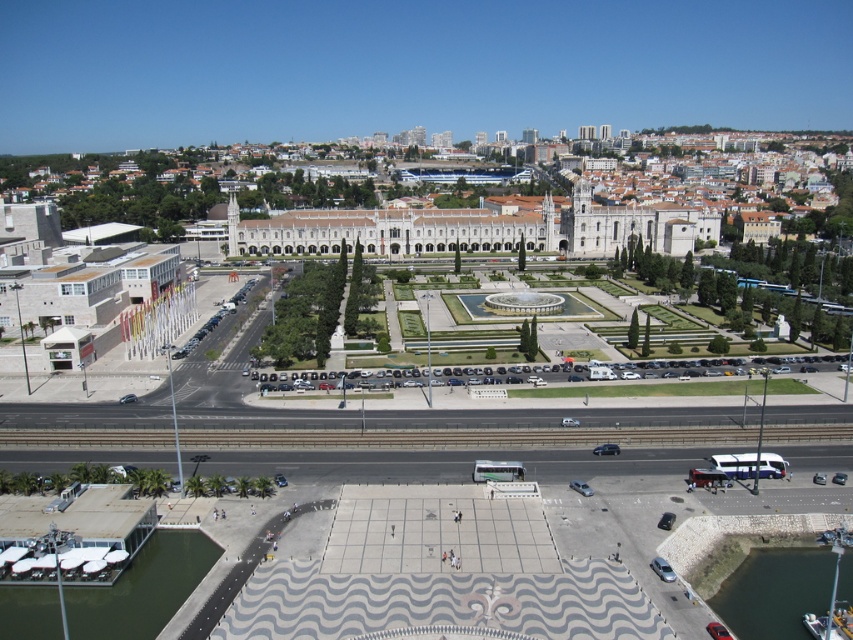
Consider the image. Can you confirm if white stone building at center is smaller than greenish concrete dock at lower left?

No, white stone building at center is not smaller than greenish concrete dock at lower left.

Can you confirm if white stone building at center is positioned below greenish concrete dock at lower left?

No, white stone building at center is not below greenish concrete dock at lower left.

The image size is (853, 640). What do you see at coordinates (477, 228) in the screenshot?
I see `white stone building at center` at bounding box center [477, 228].

Identify the location of white stone building at center. The height and width of the screenshot is (640, 853). (477, 228).

The height and width of the screenshot is (640, 853). What do you see at coordinates (142, 588) in the screenshot?
I see `greenish concrete dock at lower left` at bounding box center [142, 588].

Is greenish concrete dock at lower left positioned behind dark green water at lower right?

That is False.

This screenshot has width=853, height=640. What do you see at coordinates (142, 588) in the screenshot? I see `greenish concrete dock at lower left` at bounding box center [142, 588].

This screenshot has height=640, width=853. In order to click on greenish concrete dock at lower left in this screenshot , I will do `click(142, 588)`.

Which is below, white stone building at center or dark green water at lower right?

dark green water at lower right is lower down.

I want to click on white stone building at center, so click(x=477, y=228).